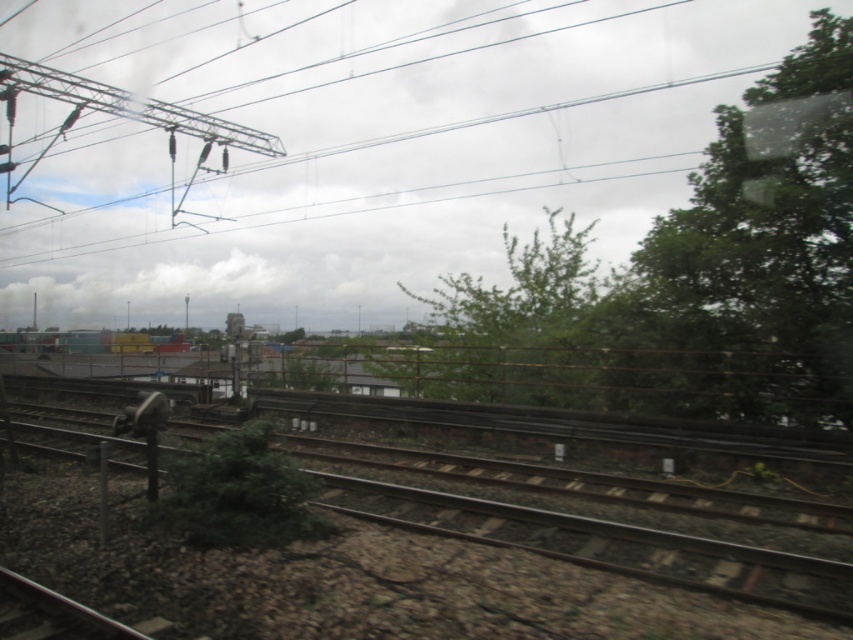
Can you confirm if metallic wire at upper center is smaller than green matte train at lower left?

Actually, metallic wire at upper center might be larger than green matte train at lower left.

The width and height of the screenshot is (853, 640). What do you see at coordinates (372, 138) in the screenshot?
I see `metallic wire at upper center` at bounding box center [372, 138].

At what (x,y) coordinates should I click in order to perform the action: click on metallic wire at upper center. Please return your answer as a coordinate pair (x, y). Looking at the image, I should click on (372, 138).

Can you confirm if metallic train track at lower left is positioned to the right of green matte train at lower left?

Yes, metallic train track at lower left is to the right of green matte train at lower left.

At what (x,y) coordinates should I click in order to perform the action: click on metallic train track at lower left. Please return your answer as a coordinate pair (x, y). The image size is (853, 640). Looking at the image, I should click on (341, 579).

Who is more distant from viewer, (694, 604) or (77, 339)?

Positioned behind is point (77, 339).

The width and height of the screenshot is (853, 640). I want to click on metallic train track at lower left, so click(x=341, y=579).

Is point (350, 241) farther from camera compared to point (434, 540)?

That is True.

Is metallic wire at upper center above metallic train track at lower left?

Indeed, metallic wire at upper center is positioned over metallic train track at lower left.

This screenshot has height=640, width=853. What do you see at coordinates (372, 138) in the screenshot?
I see `metallic wire at upper center` at bounding box center [372, 138].

Find the location of a particular element. The image size is (853, 640). metallic wire at upper center is located at coordinates (372, 138).